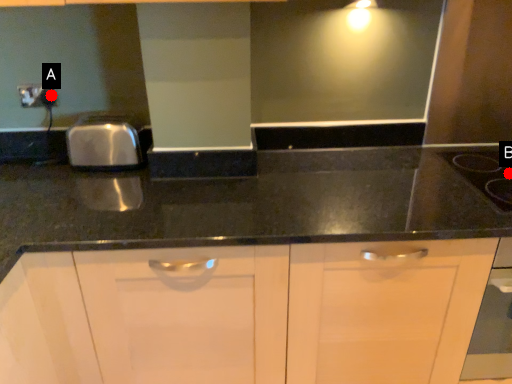
Question: Two points are circled on the image, labeled by A and B beside each circle. Which point is farther to the camera?

Choices:
 (A) A is further
 (B) B is further

Answer: (A)